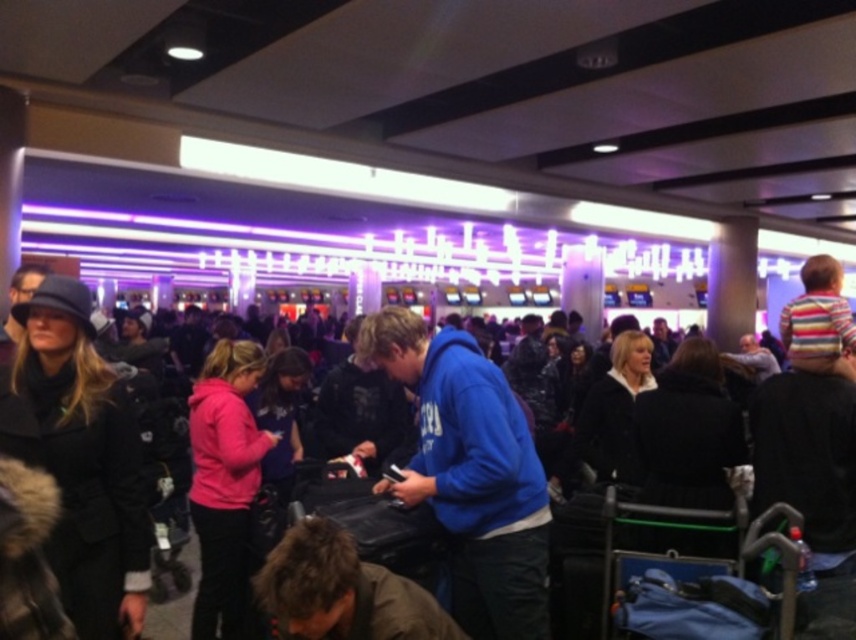
You are a GUI agent. You are given a task and a screenshot of the screen. Output one action in this format:
    pyautogui.click(x=<x>, y=<y>)
    Task: Click on the black wool coat at left
    
    Given the screenshot: What is the action you would take?
    pyautogui.click(x=80, y=458)

The image size is (856, 640). I want to click on black wool coat at left, so click(80, 458).

Between pink fleece jacket at center and black fuzzy coat at center, which one appears on the left side from the viewer's perspective?

From the viewer's perspective, pink fleece jacket at center appears more on the left side.

Who is more forward, (262, 440) or (628, 417)?

Point (262, 440) is in front.

Locate an element on the screen. Image resolution: width=856 pixels, height=640 pixels. pink fleece jacket at center is located at coordinates (224, 483).

What are the coordinates of `pink fleece jacket at center` in the screenshot? It's located at (224, 483).

Does black wool coat at left have a greater width compared to black fuzzy coat at center?

No.

Can you confirm if black wool coat at left is shorter than black fuzzy coat at center?

No, black wool coat at left is not shorter than black fuzzy coat at center.

What do you see at coordinates (80, 458) in the screenshot?
I see `black wool coat at left` at bounding box center [80, 458].

You are a GUI agent. You are given a task and a screenshot of the screen. Output one action in this format:
    pyautogui.click(x=<x>, y=<y>)
    Task: Click on the black wool coat at left
    This screenshot has height=640, width=856.
    Given the screenshot: What is the action you would take?
    pyautogui.click(x=80, y=458)